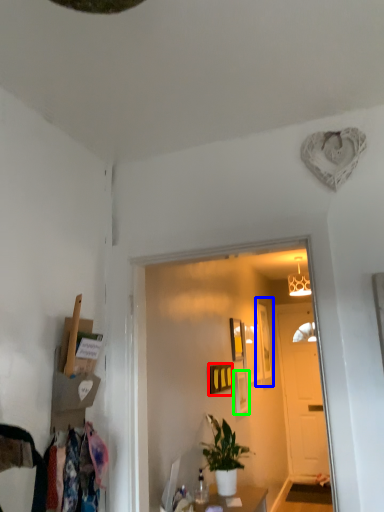
Question: Which object is the closest to the picture frame (highlighted by a red box)? Choose among these: picture frame (highlighted by a blue box) or picture frame (highlighted by a green box).

Choices:
 (A) picture frame
 (B) picture frame

Answer: (B)